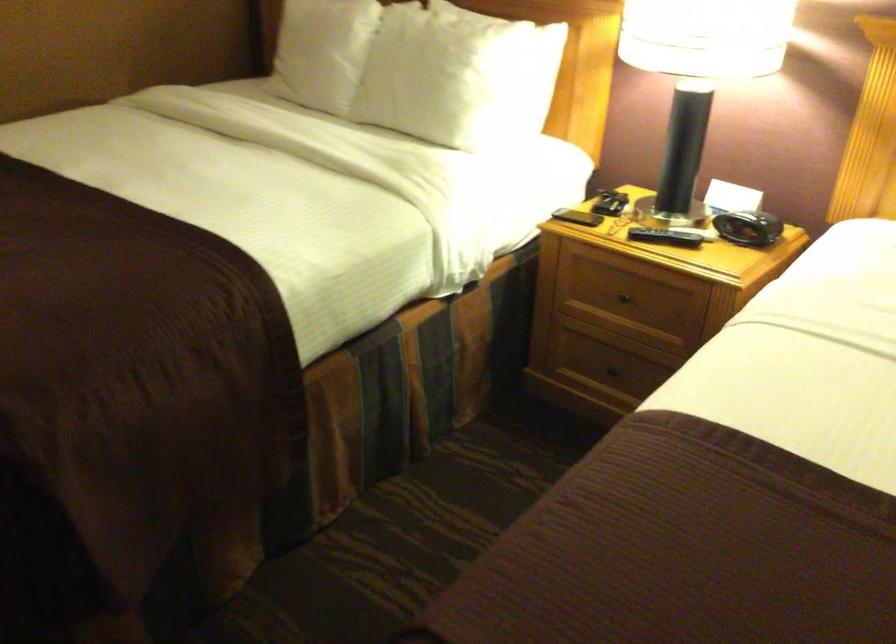
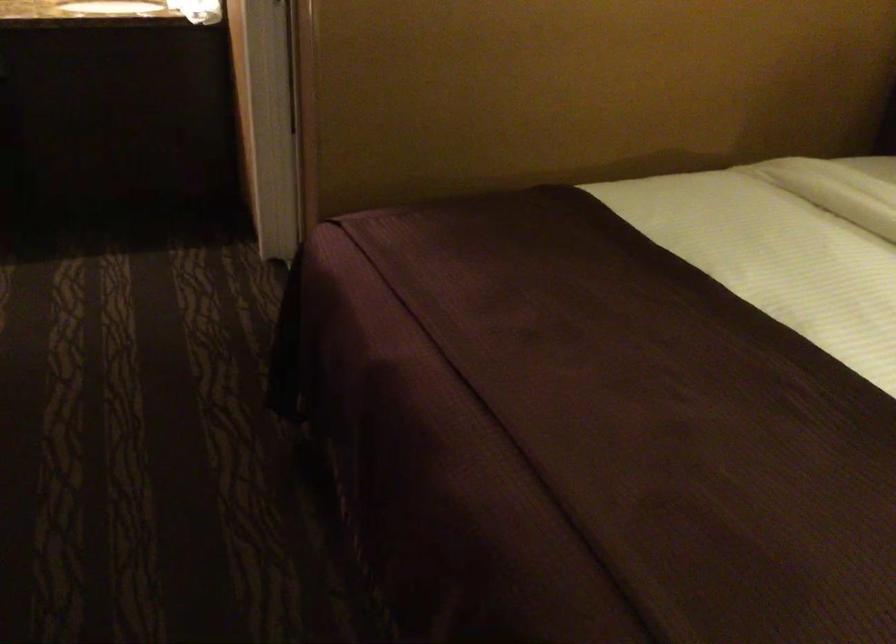
The images are taken continuously from a first-person perspective. In which direction are you moving?

The cameraman walked toward left, forward.